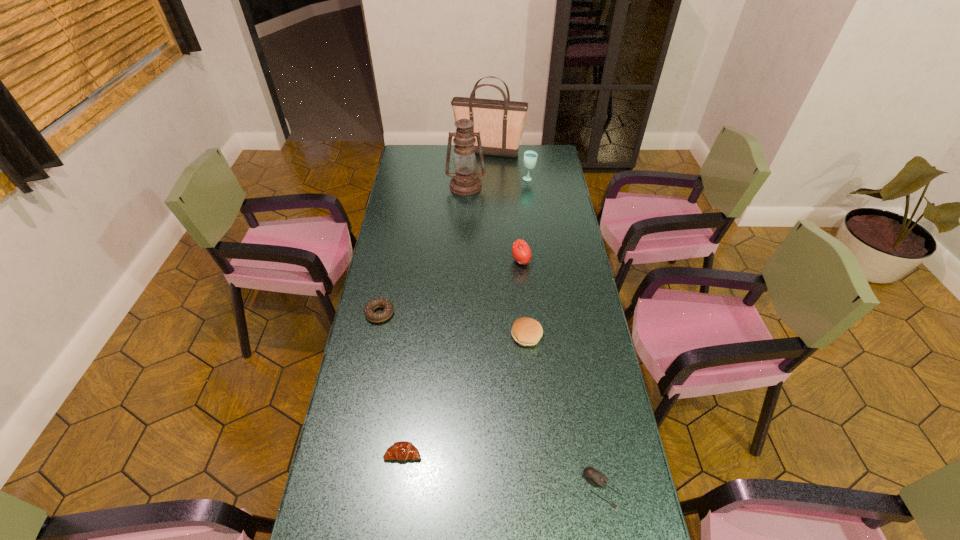
You are a GUI agent. You are given a task and a screenshot of the screen. Output one action in this format:
    pyautogui.click(x=<x>, y=<y>)
    Task: Click on the vacant space that's between the oil lamp and the apple
    This screenshot has width=960, height=540.
    Given the screenshot: What is the action you would take?
    pyautogui.click(x=493, y=224)

This screenshot has width=960, height=540. I want to click on free space between the fifth tallest object and the leftmost object, so click(453, 325).

Find the location of `free space between the glass and the shopping bag`. free space between the glass and the shopping bag is located at coordinates (509, 166).

Where is `empty location between the farthest object and the third tallest object`? The width and height of the screenshot is (960, 540). empty location between the farthest object and the third tallest object is located at coordinates (509, 166).

I want to click on object that stands as the seventh closest to the oil lamp, so click(x=594, y=477).

Locate which object is the third closest to the apple. Please provide its 2D coordinates. Your answer should be formatted as a tuple, i.e. [(x, y)], where the tuple contains the x and y coordinates of a point satisfying the conditions above.

[(387, 306)]

This screenshot has height=540, width=960. What are the coordinates of `vacant area in the image that satisfies the following two spatial constraints: 1. on the back side of the fourth shortest object; 2. on the left side of the third tallest object` in the screenshot? It's located at (513, 179).